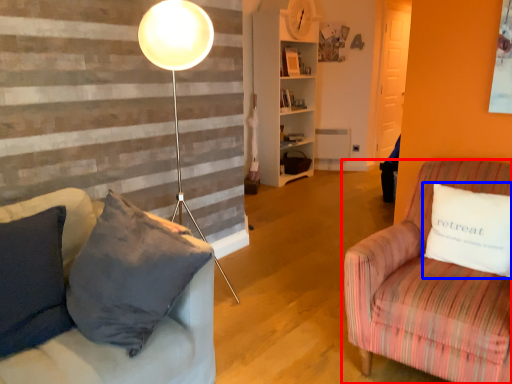
Question: Which object is further to the camera taking this photo, studio couch (highlighted by a red box) or pillow (highlighted by a blue box)?

Choices:
 (A) studio couch
 (B) pillow

Answer: (B)